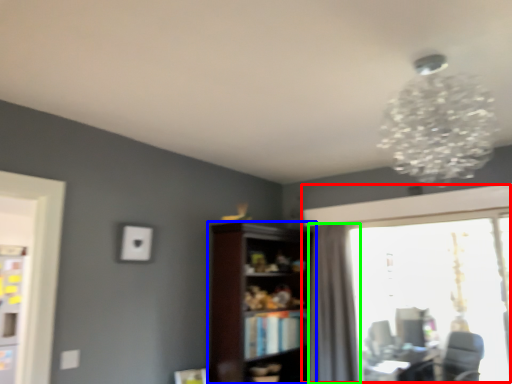
Question: Based on their relative distances, which object is farther from window (highlighted by a red box)? Choose from shelf (highlighted by a blue box) and curtain (highlighted by a green box).

Choices:
 (A) shelf
 (B) curtain

Answer: (A)